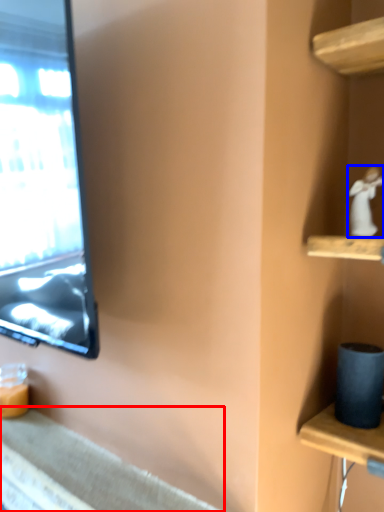
Question: Which point is closer to the camera, counter top (highlighted by a red box) or miniature (highlighted by a blue box)?

Choices:
 (A) counter top
 (B) miniature

Answer: (A)